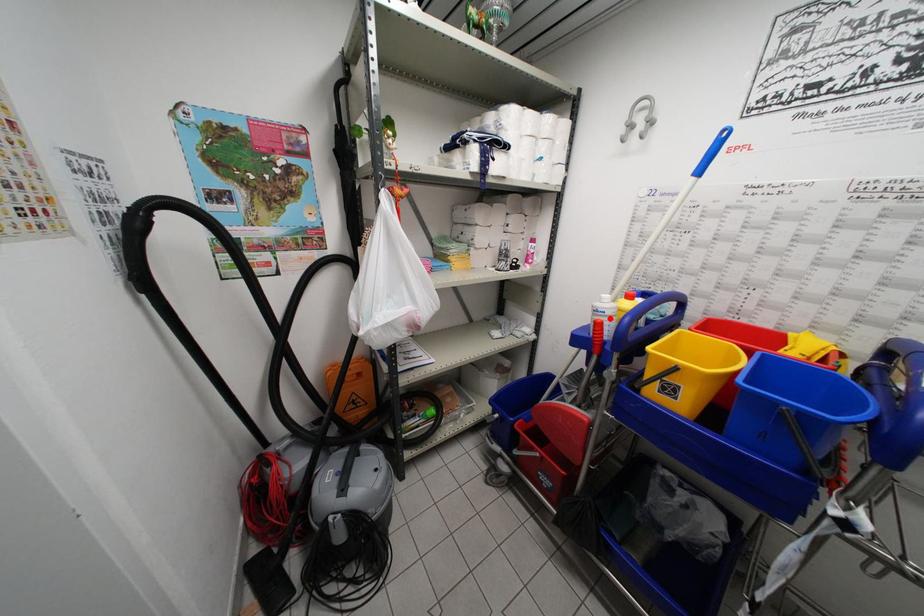
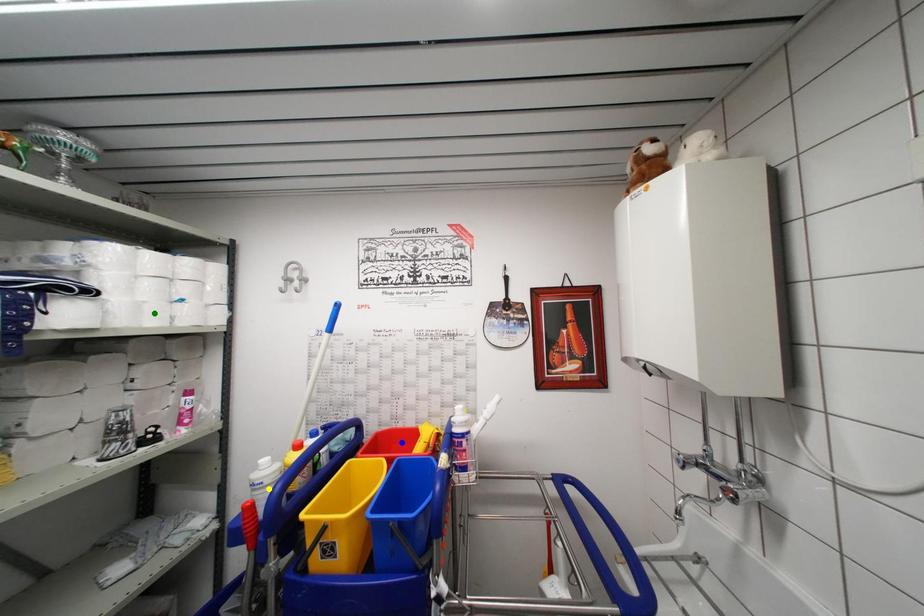
Question: I am providing you with two images of the same scene from different viewpoints. A red point is marked on the first image. You are given multiple points on the second image. Can you choose the point in image 2 that corresponds to the point in image 1?

Choices:
 (A) green point
 (B) yellow point
 (C) blue point

Answer: (B)